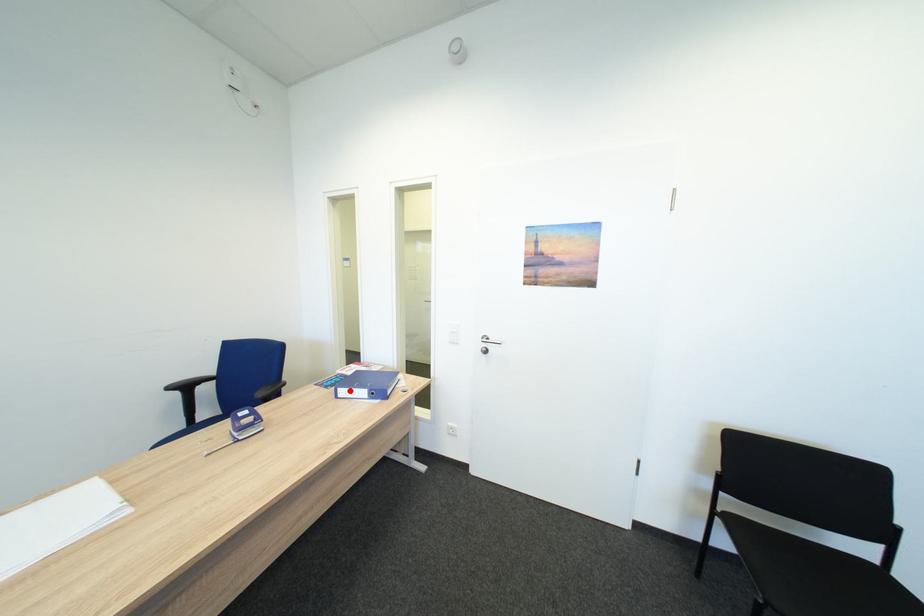
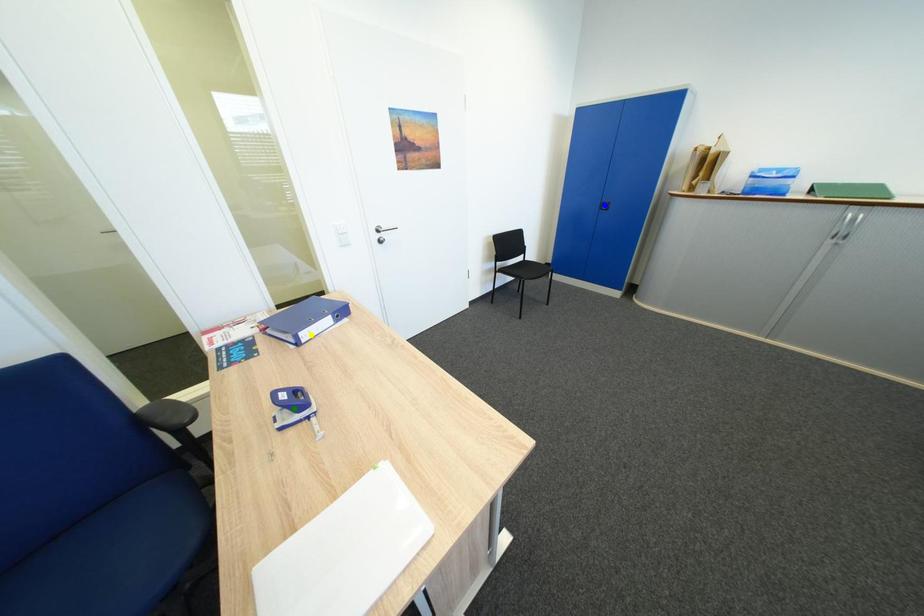
Question: I am providing you with two images of the same scene from different viewpoints. A red point is marked on the first image. You are given multiple points on the second image. In image 2, which mark is for the same physical point as the one in image 1?

Choices:
 (A) yellow point
 (B) blue point
 (C) green point

Answer: (A)